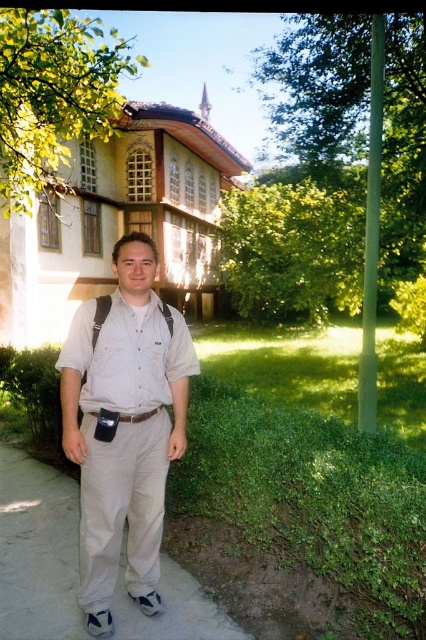
You are a photographer trying to capture the man in the khaki pants at center without any obstructions. Given the green leafy tree at upper left, will you need to adjust your camera angle to avoid the tree?

The green leafy tree at upper left is bigger than the khaki pants at center. To avoid the tree obstructing the khaki pants at center, you should adjust your camera angle to position the tree out of the frame or behind the man.

You are a photographer trying to capture a photo of the light beige cotton shirt at center and the green leafy tree at upper left. Which object is shorter in the image?

The light beige cotton shirt at center is shorter than the green leafy tree at upper left.

You are a tour guide leading a group to the building. You want to ensure everyone can see the green leafy tree at upper left from their current position in front of the light beige cotton shirt at center. What is the minimum distance the group needs to move forward to ensure the tree is visible?

The group needs to move forward at least 9.29 meters to ensure the green leafy tree at upper left is visible from the light beige cotton shirt at center position.